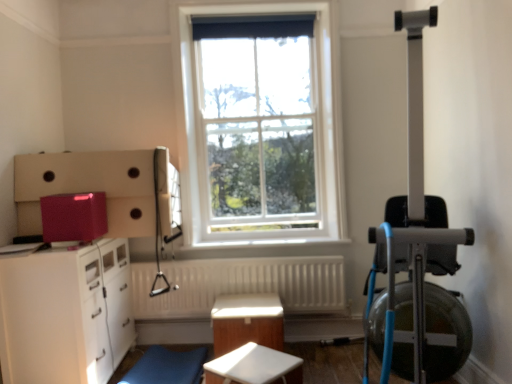
Question: Is glossy plastic container at upper left in front of or behind blue fabric swivel chair at lower center in the image?

Choices:
 (A) front
 (B) behind

Answer: (A)

Question: In terms of size, does glossy plastic container at upper left appear bigger or smaller than blue fabric swivel chair at lower center?

Choices:
 (A) big
 (B) small

Answer: (B)

Question: Which is nearer to the white matte table at center, marked as the second table in a back-to-front arrangement?

Choices:
 (A) matte pink cabinet at left
 (B) white glossy cabinet at lower left
 (C) white textured radiator at center
 (D) white glossy table at center, the 1th table viewed from the back
 (E) blue fabric swivel chair at lower center

Answer: (D)

Question: Estimate the real-world distances between objects in this image. Which object is farther from the matte pink cabinet at left?

Choices:
 (A) blue fabric swivel chair at lower center
 (B) white matte table at center, placed as the 1th table when sorted from front to back
 (C) white glossy cabinet at lower left
 (D) glossy plastic container at upper left
 (E) white glass window at center

Answer: (A)